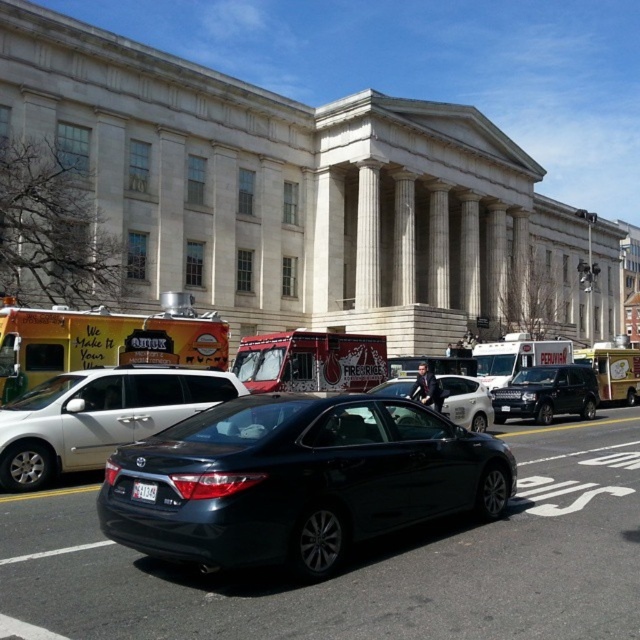
Question: Can you confirm if yellow matte food truck at lower left is wider than red metallic food truck at center?

Choices:
 (A) yes
 (B) no

Answer: (B)

Question: Which point appears farthest from the camera in this image?

Choices:
 (A) (134, 481)
 (B) (276, 344)
 (C) (202, 317)
 (D) (118, 410)

Answer: (B)

Question: Is satin black sedan at center smaller than white cardboard food truck at right?

Choices:
 (A) no
 (B) yes

Answer: (B)

Question: Is satin black sedan at center further to the viewer compared to red metallic food truck at center?

Choices:
 (A) yes
 (B) no

Answer: (B)

Question: Which of these objects is positioned closest to the shiny black suv at center?

Choices:
 (A) red metallic food truck at center
 (B) white cardboard food truck at right

Answer: (B)

Question: Which object is closer to the camera taking this photo?

Choices:
 (A) shiny black sedan at center
 (B) yellow matte food truck at lower left
 (C) glossy black sedan at center
 (D) red metallic food truck at center

Answer: (C)